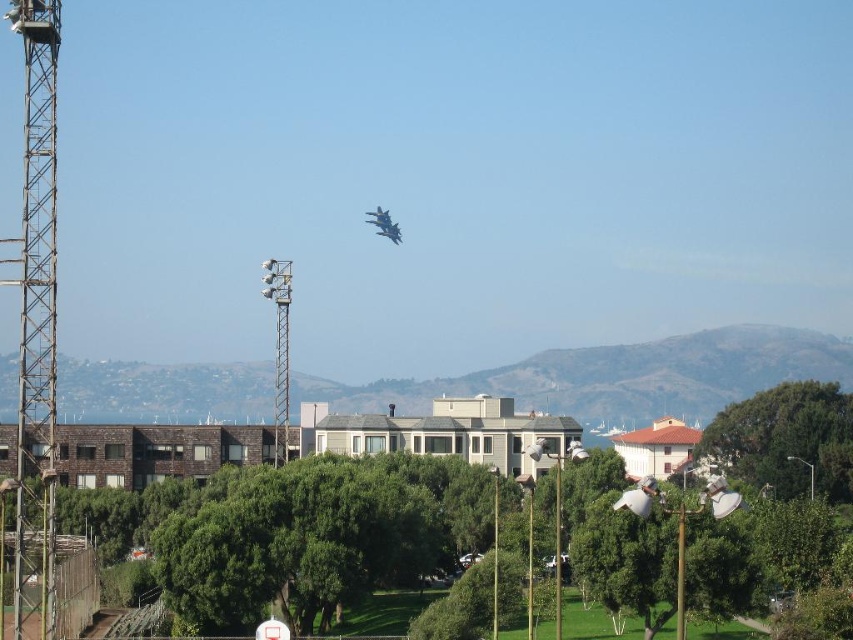
Question: Estimate the real-world distances between objects in this image. Which object is farther from the green leafy tree at center-right?

Choices:
 (A) metallic gray tower at left
 (B) shiny blue jet at center
 (C) green leafy tree at center
 (D) metallic gray tower at center-left

Answer: (A)

Question: Among these objects, which one is farthest from the camera?

Choices:
 (A) shiny blue jet at center
 (B) metallic gray tower at left

Answer: (A)

Question: Is the position of green leafy tree at center-right less distant than that of shiny blue jet at center?

Choices:
 (A) no
 (B) yes

Answer: (B)

Question: Estimate the real-world distances between objects in this image. Which object is farther from the green leafy tree at center?

Choices:
 (A) metallic gray tower at left
 (B) green leafy tree at center-right
 (C) metallic gray tower at center-left
 (D) shiny blue jet at center

Answer: (D)

Question: Where is green leafy tree at center located in relation to metallic gray tower at center-left in the image?

Choices:
 (A) below
 (B) above

Answer: (A)

Question: Does metallic gray tower at left have a smaller size compared to metallic gray tower at center-left?

Choices:
 (A) no
 (B) yes

Answer: (A)